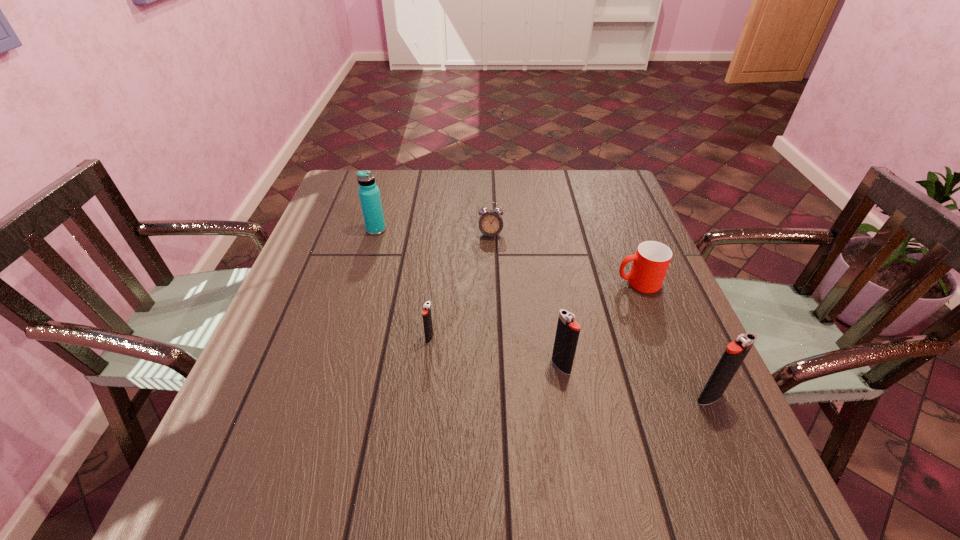
Find the location of a particular element. Image resolution: width=960 pixels, height=540 pixels. free space located 0.290m on the back of the second igniter from right to left is located at coordinates (544, 266).

Identify the location of free point located on the left of the rightmost igniter. (495, 398).

Locate an element on the screen. The image size is (960, 540). vacant position located 0.130m on the face of the third object from left to right is located at coordinates (492, 272).

This screenshot has width=960, height=540. I want to click on vacant region located 0.180m on the right of the leftmost object, so click(x=449, y=230).

Where is `free point located on the side of the cup with the handle`? This screenshot has width=960, height=540. free point located on the side of the cup with the handle is located at coordinates tap(563, 283).

Locate an element on the screen. Image resolution: width=960 pixels, height=540 pixels. vacant space located 0.200m on the side of the cup with the handle is located at coordinates (534, 283).

Locate an element on the screen. blank space located on the side of the cup with the handle is located at coordinates (591, 283).

Locate an element on the screen. The height and width of the screenshot is (540, 960). object located at the left edge is located at coordinates (369, 193).

You are a GUI agent. You are given a task and a screenshot of the screen. Output one action in this format:
    pyautogui.click(x=<x>, y=<y>)
    Task: Click on the igniter situated at the right edge
    Image resolution: width=960 pixels, height=540 pixels.
    Given the screenshot: What is the action you would take?
    pyautogui.click(x=736, y=351)

Identify the location of cup located in the right edge section of the desktop. Image resolution: width=960 pixels, height=540 pixels. (650, 262).